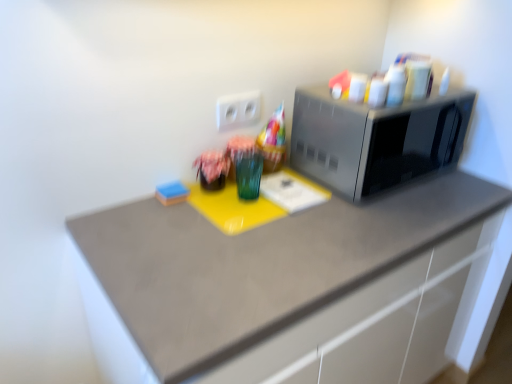
Image resolution: width=512 pixels, height=384 pixels. In order to click on vacant space that is in between blue sponge at lower left and green glass at center in this screenshot , I will do `click(211, 204)`.